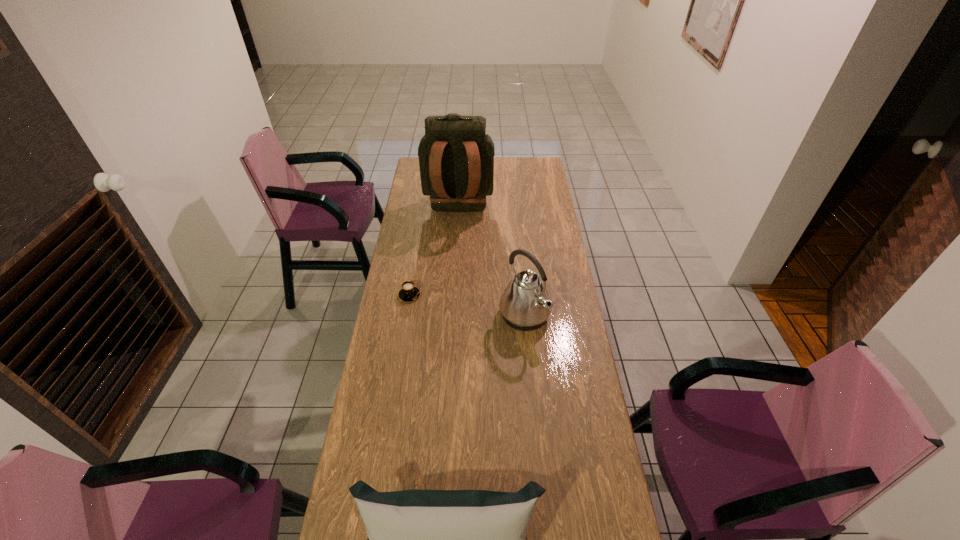
Locate an element on the screen. the farthest object is located at coordinates pyautogui.click(x=456, y=157).

Identify the location of the tallest object. This screenshot has height=540, width=960. (456, 157).

The image size is (960, 540). Find the location of `kettle`. kettle is located at coordinates (525, 305).

Identify the location of the shortest object. (408, 293).

Where is `vacant area located on the back of the backpack`? vacant area located on the back of the backpack is located at coordinates (454, 291).

You are a GUI agent. You are given a task and a screenshot of the screen. Output one action in this format:
    pyautogui.click(x=<x>, y=<y>)
    Task: Click on the free location located on the back of the kettle
    
    Given the screenshot: What is the action you would take?
    pyautogui.click(x=520, y=275)

Find the location of `vacant area situated 0.340m on the right of the cappuccino`. vacant area situated 0.340m on the right of the cappuccino is located at coordinates (502, 295).

The image size is (960, 540). I want to click on backpack that is at the left edge, so click(456, 157).

Locate an element on the screen. cappuccino located in the left edge section of the desktop is located at coordinates (408, 293).

You are a GUI agent. You are given a task and a screenshot of the screen. Output one action in this format:
    pyautogui.click(x=<x>, y=<y>)
    Task: Click on the object that is at the right edge
    The image size is (960, 540).
    Given the screenshot: What is the action you would take?
    pyautogui.click(x=525, y=305)